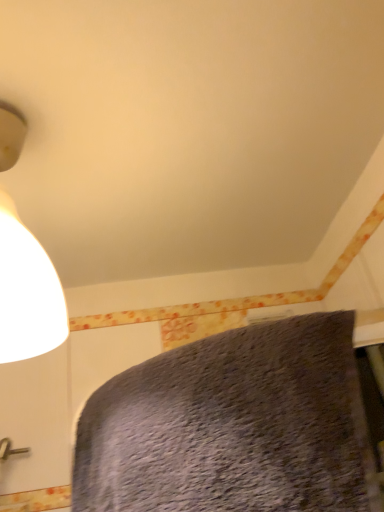
Question: Can you confirm if textured gray bed at lower center is shorter than matte white lampshade at upper left?

Choices:
 (A) no
 (B) yes

Answer: (B)

Question: Does textured gray bed at lower center have a smaller size compared to matte white lampshade at upper left?

Choices:
 (A) no
 (B) yes

Answer: (A)

Question: Considering the relative positions of textured gray bed at lower center and matte white lampshade at upper left in the image provided, is textured gray bed at lower center to the left of matte white lampshade at upper left from the viewer's perspective?

Choices:
 (A) yes
 (B) no

Answer: (B)

Question: From a real-world perspective, is textured gray bed at lower center positioned over matte white lampshade at upper left based on gravity?

Choices:
 (A) no
 (B) yes

Answer: (A)

Question: Can you confirm if textured gray bed at lower center is positioned to the right of matte white lampshade at upper left?

Choices:
 (A) yes
 (B) no

Answer: (A)

Question: Is matte white lampshade at upper left located within textured gray bed at lower center?

Choices:
 (A) yes
 (B) no

Answer: (B)

Question: Does matte white lampshade at upper left appear on the right side of textured gray bed at lower center?

Choices:
 (A) yes
 (B) no

Answer: (B)

Question: Is the depth of matte white lampshade at upper left less than that of textured gray bed at lower center?

Choices:
 (A) yes
 (B) no

Answer: (B)

Question: Is matte white lampshade at upper left aimed at textured gray bed at lower center?

Choices:
 (A) yes
 (B) no

Answer: (B)

Question: Does matte white lampshade at upper left have a lesser width compared to textured gray bed at lower center?

Choices:
 (A) yes
 (B) no

Answer: (B)

Question: Is matte white lampshade at upper left not inside textured gray bed at lower center?

Choices:
 (A) no
 (B) yes

Answer: (B)

Question: Is matte white lampshade at upper left smaller than textured gray bed at lower center?

Choices:
 (A) no
 (B) yes

Answer: (B)

Question: From a real-world perspective, is matte white lampshade at upper left positioned above or below textured gray bed at lower center?

Choices:
 (A) below
 (B) above

Answer: (B)